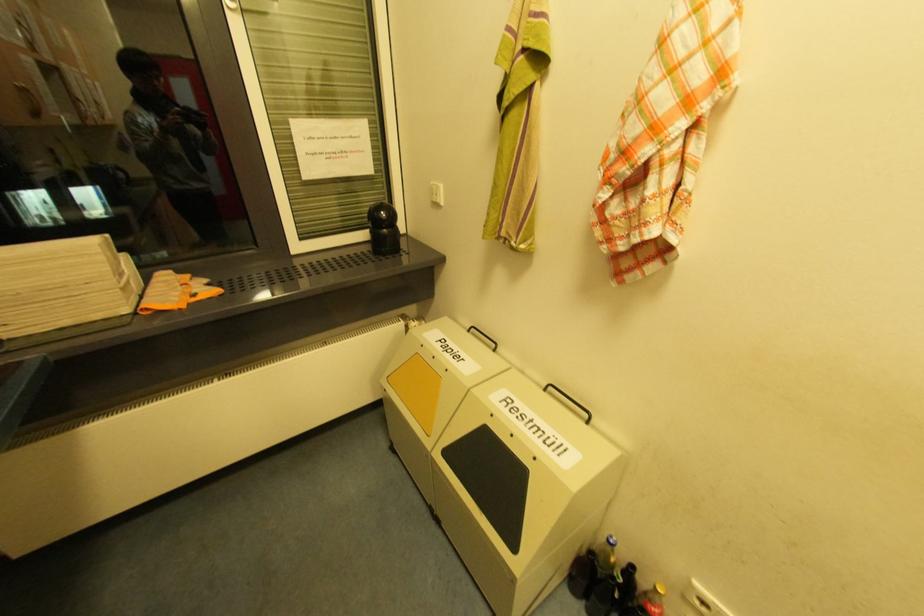
Image resolution: width=924 pixels, height=616 pixels. Describe the element at coordinates (436, 193) in the screenshot. I see `a white electrical socket` at that location.